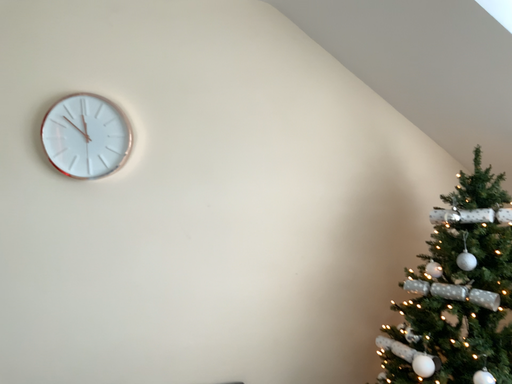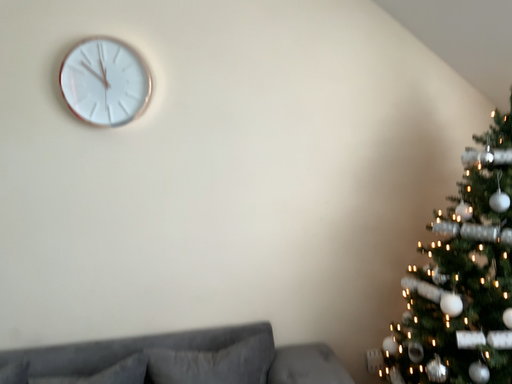
Question: Which way did the camera rotate in the video?

Choices:
 (A) rotated downward
 (B) rotated upward

Answer: (A)